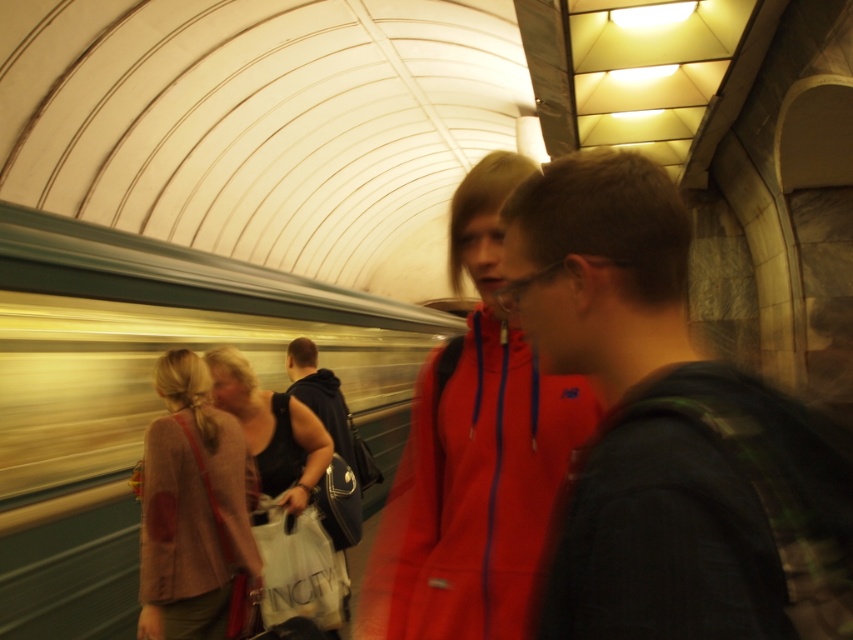
You are a photographer trying to capture a candid shot of the matte red jacket at center and the dark gray fabric backpack at center in the subway station. Since you want both subjects to be clearly visible, which object should you focus on to ensure it takes up more of the frame?

A: The dark gray fabric backpack at center occupies more space than the matte red jacket at center, so focusing on it will ensure it takes up more of the frame while still keeping the matte red jacket at center in view.

You are standing in the subway station and want to locate the matte red jacket at center. According to the coordinates provided, where would you look to find it?

The matte red jacket at center is located at coordinates point [474,454].